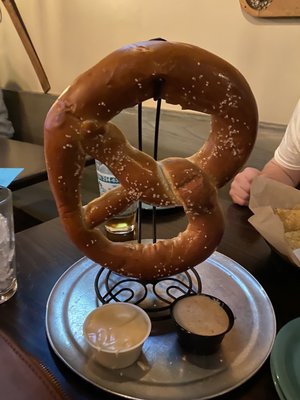
At what (x,y) coordinates should I click in order to perform the action: click on table. Please return your answer as a coordinate pair (x, y). The image size is (300, 400). Looking at the image, I should click on (243, 237).